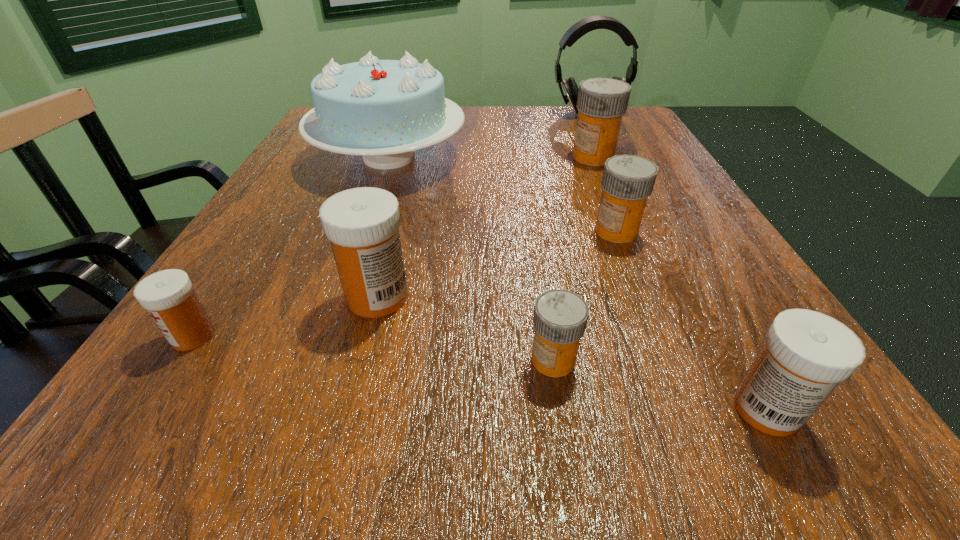
At what (x,y) coordinates should I click in order to perform the action: click on birthday cake present at the far edge. Please return your answer as a coordinate pair (x, y). This screenshot has width=960, height=540. Looking at the image, I should click on (383, 110).

Locate an element on the screen. object that is at the near edge is located at coordinates (806, 354).

In order to click on birthday cake present at the left edge in this screenshot , I will do `click(383, 110)`.

I want to click on medicine at the left edge, so click(168, 296).

Find the location of a particular element. The height and width of the screenshot is (540, 960). earphone that is positioned at the right edge is located at coordinates (591, 23).

This screenshot has width=960, height=540. I want to click on object located in the far left corner section of the desktop, so click(x=383, y=110).

Image resolution: width=960 pixels, height=540 pixels. Identify the location of object that is at the far right corner. (591, 23).

Where is `object situated at the near right corner`? Image resolution: width=960 pixels, height=540 pixels. object situated at the near right corner is located at coordinates (806, 354).

Image resolution: width=960 pixels, height=540 pixels. Identify the location of vacant space at the far edge of the desktop. (574, 141).

I want to click on vacant space at the near edge of the desktop, so click(x=591, y=407).